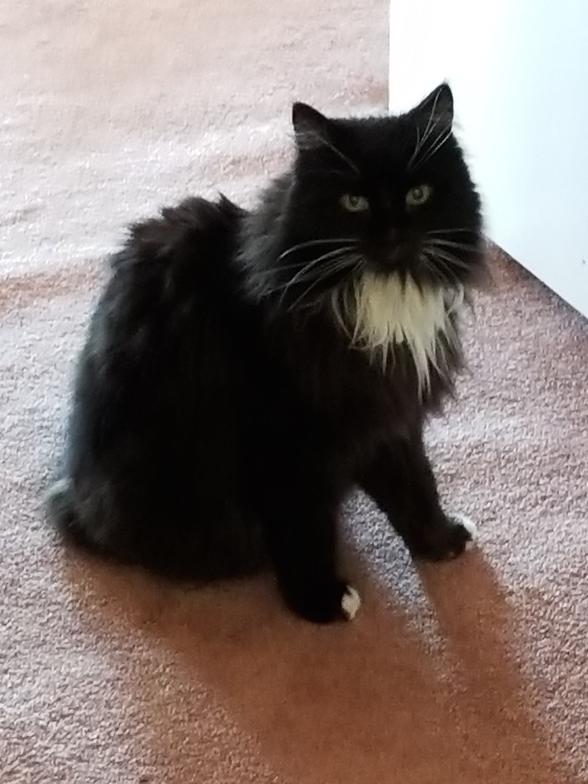
Locate an element on the screen. beige carpet is located at coordinates (540, 470).